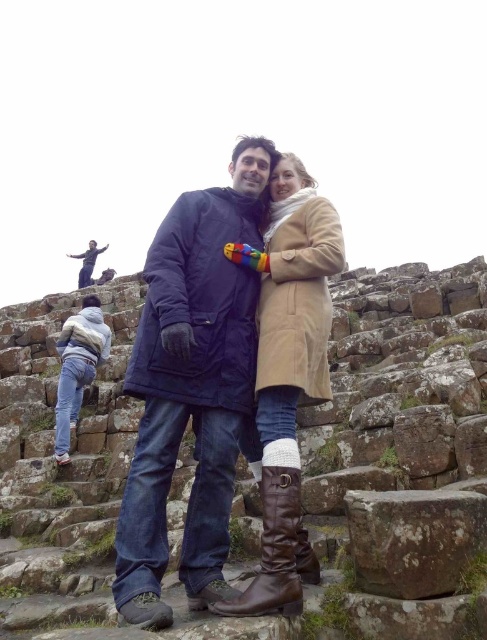
Question: Can you confirm if beige suede coat at center is positioned above brown leather boot at lower center?

Choices:
 (A) yes
 (B) no

Answer: (A)

Question: Does beige suede coat at center appear on the right side of brown leather boot at center?

Choices:
 (A) yes
 (B) no

Answer: (B)

Question: Based on their relative distances, which object is farther from the brown rough stone at center?

Choices:
 (A) rusty stone at center
 (B) dark blue woolen coat at center

Answer: (B)

Question: Which of the following is the farthest from the observer?

Choices:
 (A) brown rough stone at center
 (B) rusty stone at center
 (C) brown leather boot at lower center

Answer: (B)

Question: Is rusty stone at center wider than brown leather boot at lower center?

Choices:
 (A) yes
 (B) no

Answer: (A)

Question: Which point is closer to the camera taking this photo?

Choices:
 (A) (265, 531)
 (B) (438, 524)
 (C) (120, 486)

Answer: (B)